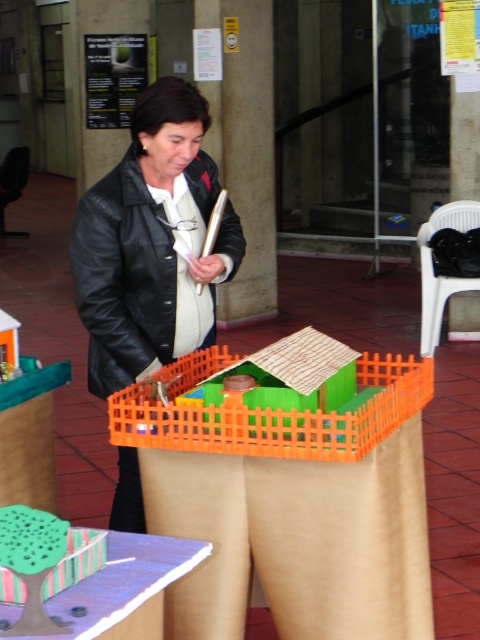
Does black leather jacket at center have a lesser width compared to matte green paper at lower left?

Incorrect, black leather jacket at center's width is not less than matte green paper at lower left's.

Is black leather jacket at center positioned in front of matte green paper at lower left?

No, black leather jacket at center is behind matte green paper at lower left.

Who is more distant from viewer, [137,490] or [49,614]?

The point [137,490] is more distant.

Image resolution: width=480 pixels, height=640 pixels. I want to click on black leather jacket at center, so click(152, 243).

How distant is black leather jacket at center from green plastic house at center?

black leather jacket at center is 27.46 inches from green plastic house at center.

Does point (204, 221) come closer to viewer compared to point (213, 419)?

No, it is behind (213, 419).

Describe the element at coordinates (152, 243) in the screenshot. The width and height of the screenshot is (480, 640). I see `black leather jacket at center` at that location.

In order to click on black leather jacket at center in this screenshot , I will do `click(152, 243)`.

Is point (335, 413) less distant than point (45, 605)?

No, it is not.

Locate an element on the screen. The image size is (480, 640). green plastic house at center is located at coordinates (271, 412).

Which is behind, point (184, 449) or point (82, 630)?

The point (184, 449) is behind.

Identify the location of green plastic house at center. (271, 412).